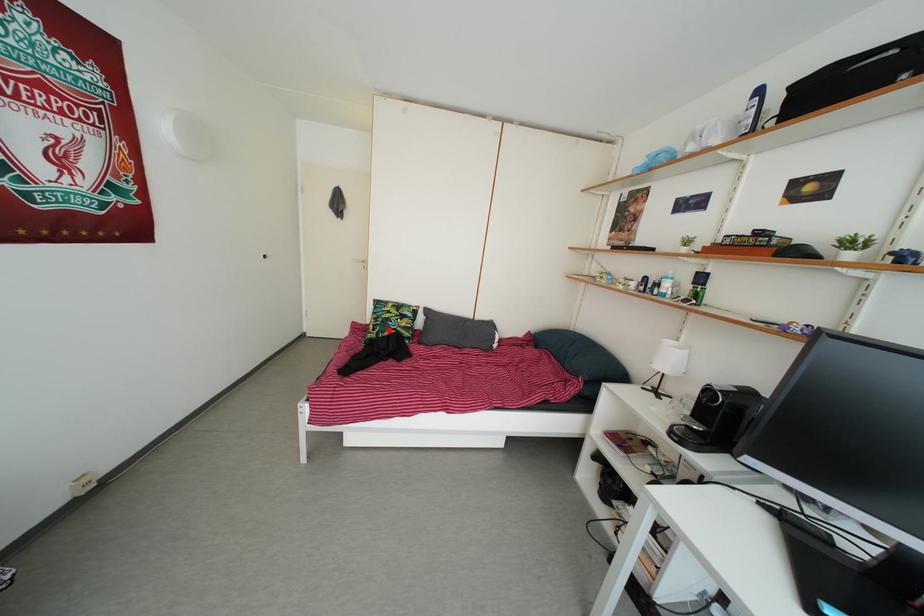
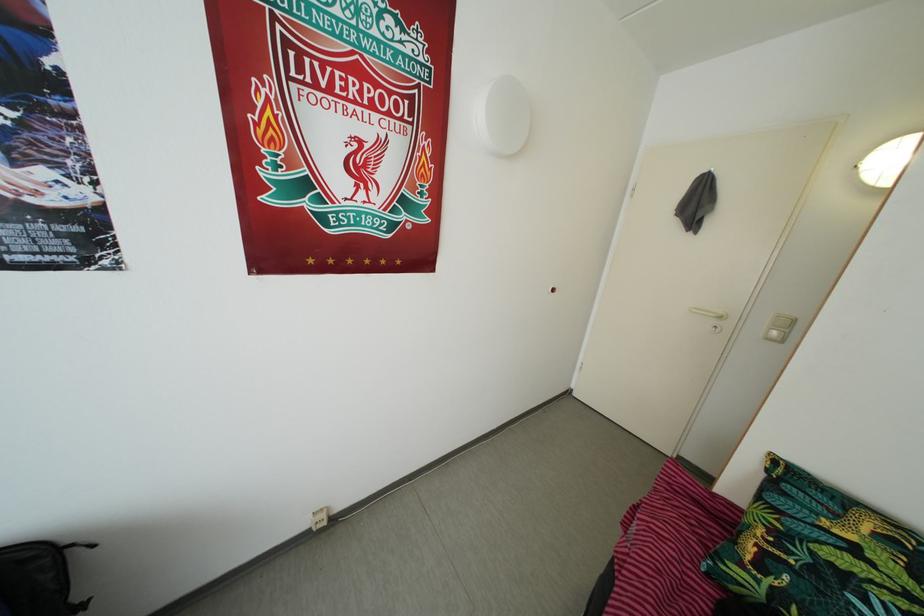
Question: I am providing you with two images of the same scene from different viewpoints. Given a red point in image1, look at the same physical point in image2. Is it:

Choices:
 (A) Closer to the viewpoint
 (B) Farther from the viewpoint

Answer: (A)